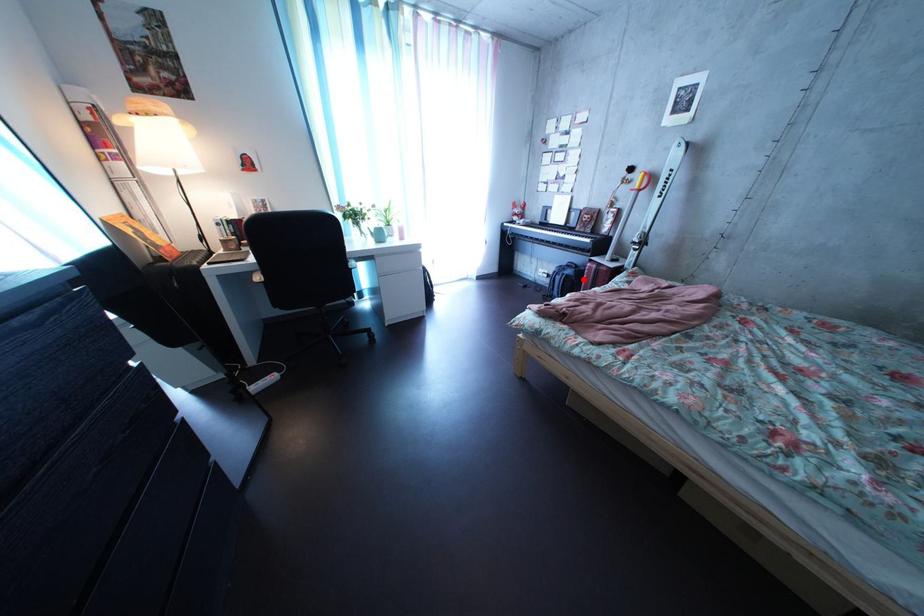
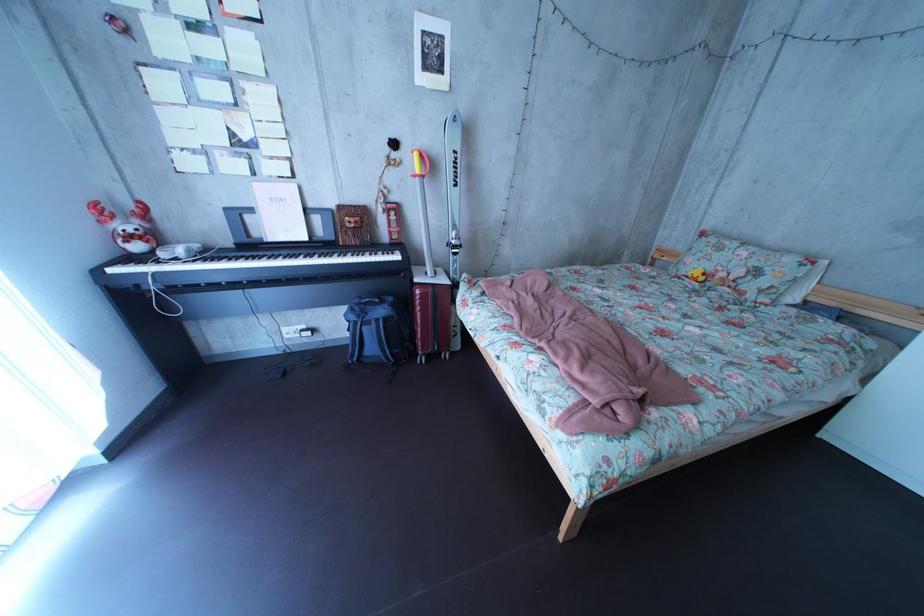
Question: I am providing you with two images of the same scene from different viewpoints. A red point is marked on the first image. At the location where the point appears in image 1, is it still visible in image 2?

Choices:
 (A) Yes
 (B) No

Answer: (A)